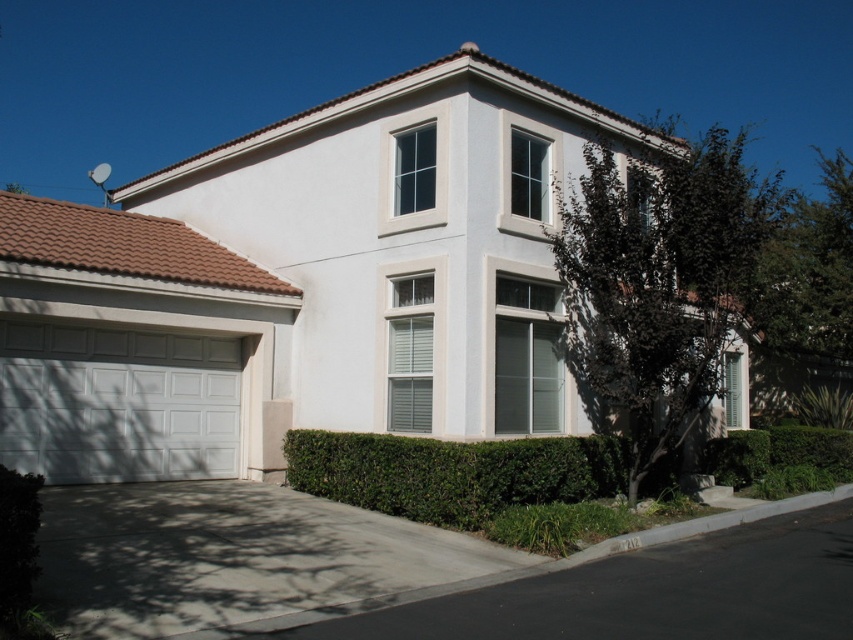
Does point (599, 355) lie in front of point (260, 486)?

Yes, it is.

Between dark green leafy tree at center-right and gray concrete driveway at lower left, which one has more height?

With more height is dark green leafy tree at center-right.

Is point (672, 248) positioned before point (154, 554)?

No, (672, 248) is further to viewer.

You are a GUI agent. You are given a task and a screenshot of the screen. Output one action in this format:
    pyautogui.click(x=<x>, y=<y>)
    Task: Click on the dark green leafy tree at center-right
    
    Given the screenshot: What is the action you would take?
    pyautogui.click(x=660, y=282)

Does gray concrete driveway at lower left have a lesser height compared to green leafy hedge at lower center?

Indeed, gray concrete driveway at lower left has a lesser height compared to green leafy hedge at lower center.

Is gray concrete driveway at lower left above green leafy hedge at lower center?

No.

Is point (187, 612) in front of point (448, 484)?

Yes, point (187, 612) is in front of point (448, 484).

Locate an element on the screen. The width and height of the screenshot is (853, 640). gray concrete driveway at lower left is located at coordinates (230, 556).

Is point (137, 384) positioned before point (795, 444)?

Yes, it is in front of point (795, 444).

Who is more forward, (33, 456) or (717, 460)?

Point (33, 456) is in front.

Is point (51, 412) more distant than point (734, 461)?

No, it is not.

I want to click on white matte/glossy garage door at lower left, so [117, 403].